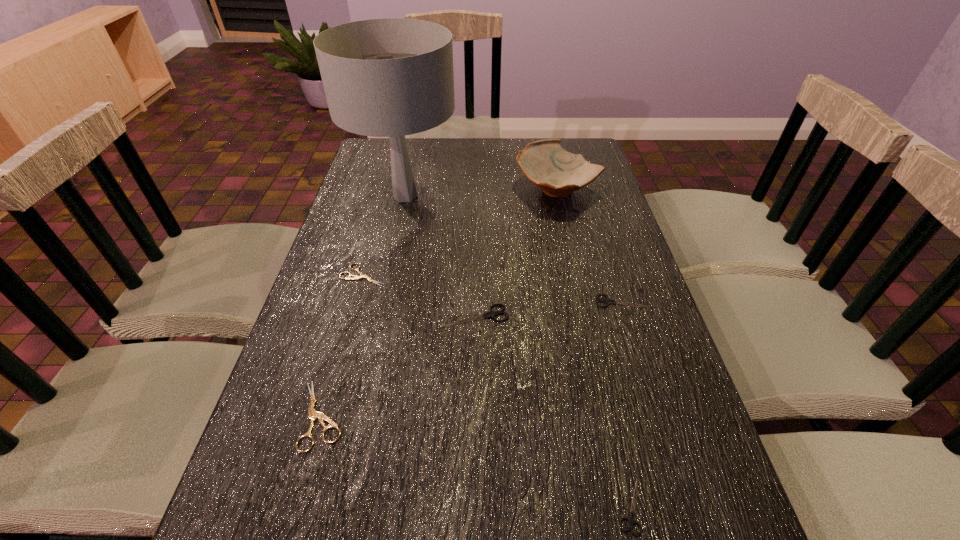
The width and height of the screenshot is (960, 540). In order to click on free region that satisfies the following two spatial constraints: 1. on the front-facing side of the rightmost black shears; 2. on the left side of the lampshade in this screenshot , I will do `click(382, 301)`.

Identify the location of vacant area that satisfies the following two spatial constraints: 1. on the back side of the third tallest object; 2. on the left side of the rightmost shears. This screenshot has height=540, width=960. (476, 301).

Locate an element on the screen. The height and width of the screenshot is (540, 960). free space that satisfies the following two spatial constraints: 1. on the front side of the pottery; 2. on the right side of the rightmost shears is located at coordinates (582, 301).